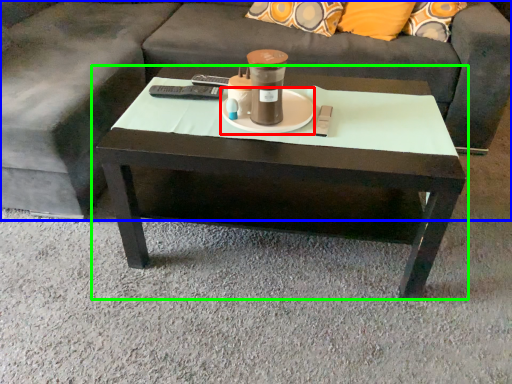
Question: Which object is the closest to the saucer (highlighted by a red box)? Choose among these: studio couch (highlighted by a blue box) or coffee table (highlighted by a green box).

Choices:
 (A) studio couch
 (B) coffee table

Answer: (B)